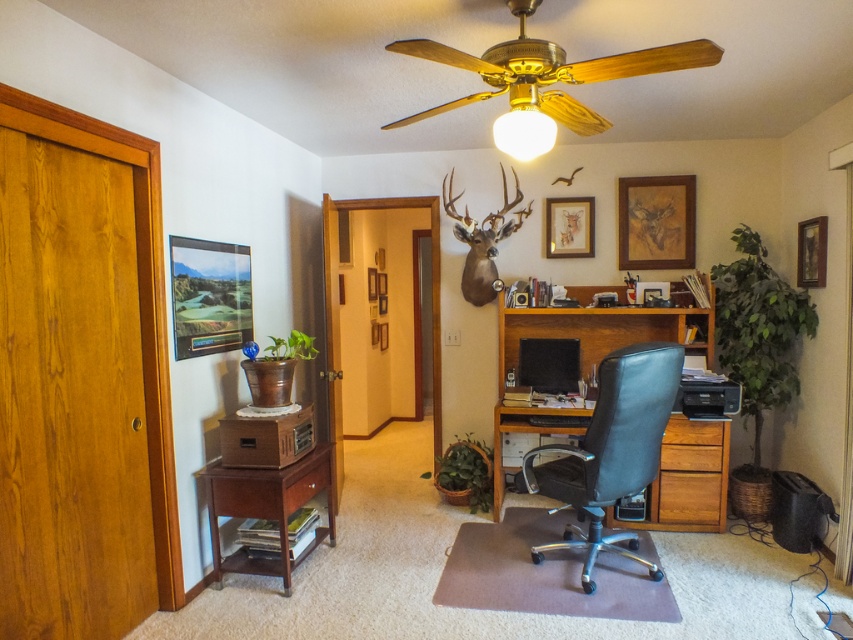
Question: Is black leather swivel chair at center positioned at the back of matte black picture frame at upper left?

Choices:
 (A) yes
 (B) no

Answer: (B)

Question: Which of the following is the farthest from the observer?

Choices:
 (A) (593, 227)
 (B) (817, 257)
 (C) (561, 48)

Answer: (A)

Question: Observing the image, what is the correct spatial positioning of black leather swivel chair at center in reference to wooden drawer at center-right?

Choices:
 (A) left
 (B) right

Answer: (A)

Question: Which is farther from the matte gold ceiling fan at upper center?

Choices:
 (A) wooden drawer at center
 (B) brown wood drawer at lower right

Answer: (A)

Question: Is woodendesk at center positioned before brown wood drawer at lower right?

Choices:
 (A) yes
 (B) no

Answer: (B)

Question: Which point is farther from the camera taking this photo?

Choices:
 (A) (519, 120)
 (B) (701, 509)

Answer: (B)